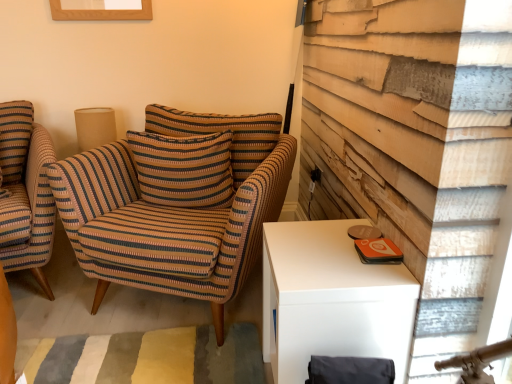
Question: From a real-world perspective, is striped fabric armchair at center, the second chair when ordered from left to right, positioned above or below burlap lampshade at upper left?

Choices:
 (A) above
 (B) below

Answer: (B)

Question: In the image, is striped fabric armchair at center, acting as the first chair starting from the right, positioned in front of or behind burlap lampshade at upper left?

Choices:
 (A) behind
 (B) front

Answer: (B)

Question: Which of these objects is positioned closest to the striped fabric armchair at left, arranged as the first chair when viewed from the left?

Choices:
 (A) striped fabric pillow at center
 (B) burlap lampshade at upper left
 (C) striped fabric armchair at center, acting as the first chair starting from the right

Answer: (B)

Question: Which object is the farthest from the striped fabric armchair at left, arranged as the first chair when viewed from the left?

Choices:
 (A) burlap lampshade at upper left
 (B) striped fabric armchair at center, the second chair when ordered from left to right
 (C) striped fabric pillow at center

Answer: (C)